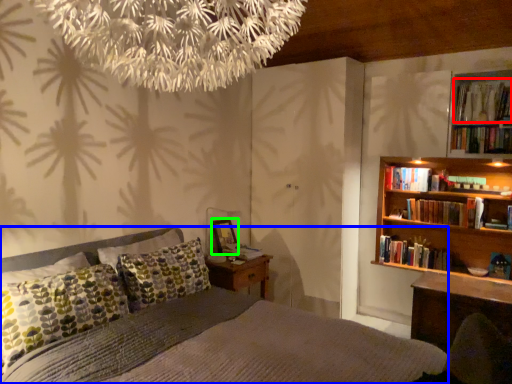
Question: Based on their relative distances, which object is farther from book (highlighted by a red box)? Choose from bed (highlighted by a blue box) and picture frame (highlighted by a green box).

Choices:
 (A) bed
 (B) picture frame

Answer: (A)